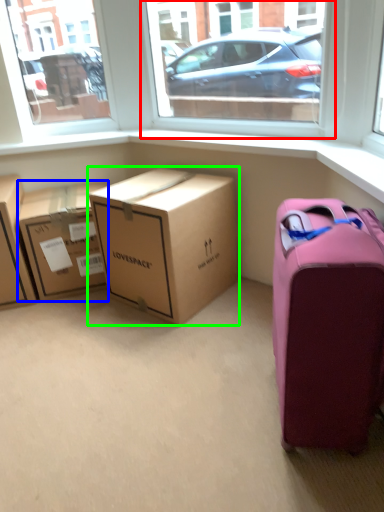
Question: Based on their relative distances, which object is farther from window screen (highlighted by a red box)? Choose from box (highlighted by a blue box) and box (highlighted by a green box).

Choices:
 (A) box
 (B) box

Answer: (A)